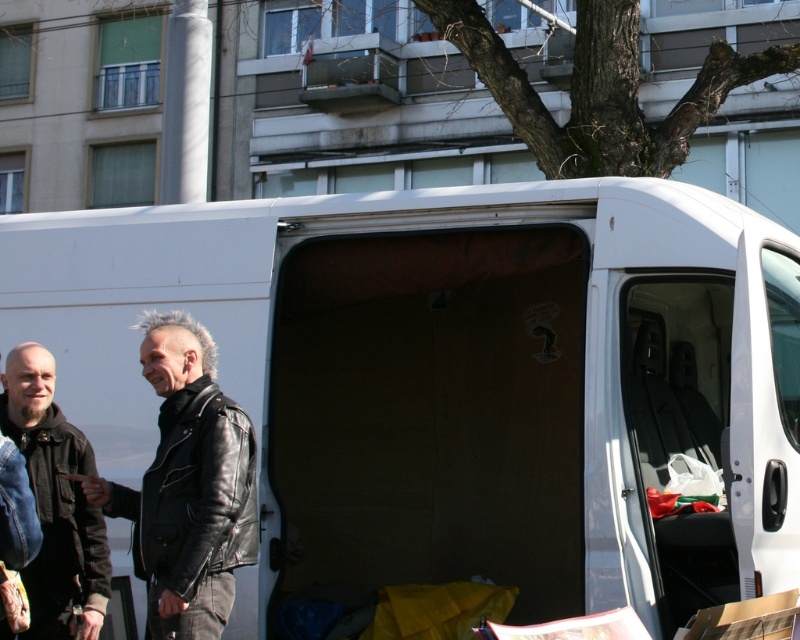
You are a delivery person who needs to place a 20 inch package into the space between the black leather jacket at center and the leather jacket at left. Can you fit the package in that space?

The space between the black leather jacket at center and the leather jacket at left is 21.07 inches, so the 20 inch package can fit as it is slightly narrower than the available space.

You are a delivery person who needs to load a tall package into the white matte van at center. The package is as tall as the leather jacket at left. Will the package fit vertically inside the van?

The white matte van at center is taller than the leather jacket at left, so the package that matches the jacket height will fit vertically inside the van.

You are trying to determine if the white matte van at center can fit through a narrow alley that is only as wide as the leather jacket at left. Based on their sizes, can the van fit through the alley?

The white matte van at center is larger in size than the leather jacket at left. Since the alley is only as wide as the leather jacket at left, the van cannot fit through the alley because it is wider than the alleyway.